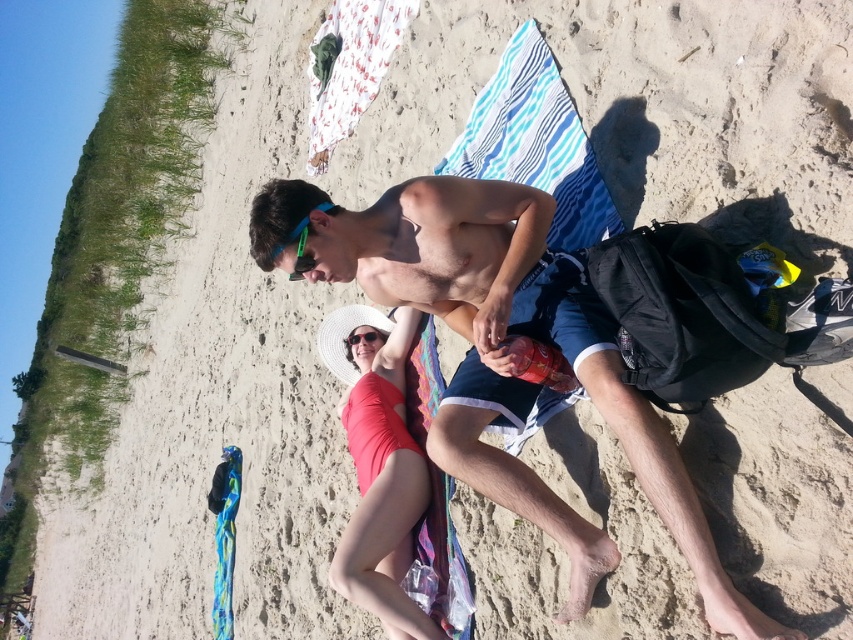
Which is more to the left, white woven hat at center or green rubber earbuds at upper center?

From the viewer's perspective, green rubber earbuds at upper center appears more on the left side.

Is the position of white woven hat at center more distant than that of green rubber earbuds at upper center?

Yes, white woven hat at center is behind green rubber earbuds at upper center.

Who is more forward, (350, 422) or (310, 259)?

Point (310, 259) is more forward.

The image size is (853, 640). I want to click on white woven hat at center, so click(378, 465).

Is shiny metallic can at center taller than green rubber earbuds at upper center?

Correct, shiny metallic can at center is much taller as green rubber earbuds at upper center.

Can you confirm if shiny metallic can at center is smaller than green rubber earbuds at upper center?

Actually, shiny metallic can at center might be larger than green rubber earbuds at upper center.

Locate an element on the screen. shiny metallic can at center is located at coordinates click(x=506, y=355).

Which is in front, point (289, 236) or point (303, 244)?

Point (289, 236) is in front.

Can you confirm if green rubber earbuds at upper center is positioned to the right of green matte goggles at center?

Correct, you'll find green rubber earbuds at upper center to the right of green matte goggles at center.

Does point (312, 259) lie behind point (308, 262)?

That is False.

I want to click on green rubber earbuds at upper center, so click(300, 250).